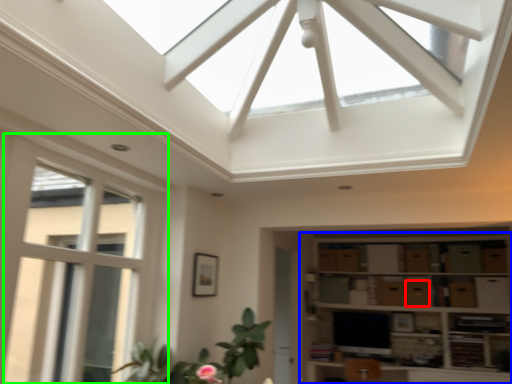
Question: Which object is positioned closest to drawer (highlighted by a red box)? Select from shelf (highlighted by a blue box) and window (highlighted by a green box).

Choices:
 (A) shelf
 (B) window

Answer: (A)